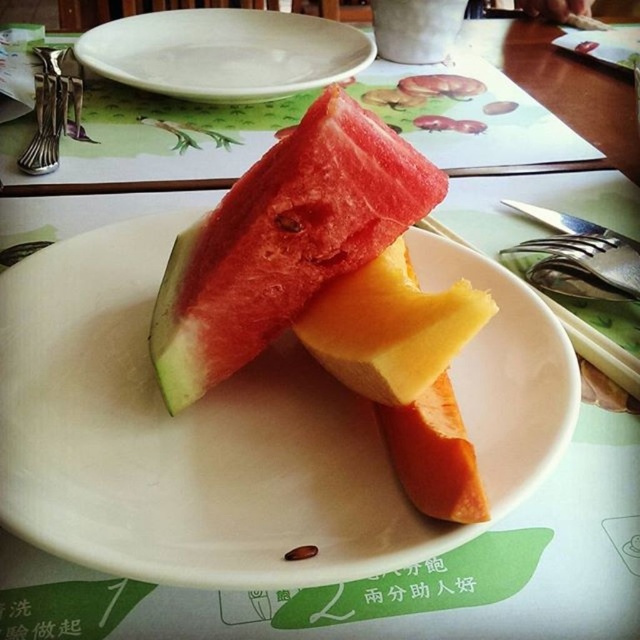
Where is the yellow smooth melon at center located in the image?

The yellow smooth melon at center is located at point coordinates of approximately 0.512 on the x axis and 0.611 on the y axis.

You are a food critic analyzing the placement of the seed on the plate. The seed is located at point (284, 241). Which food item on the plate does this seed belong to?

The seed at point (284, 241) is on the red matte watermelon at center.